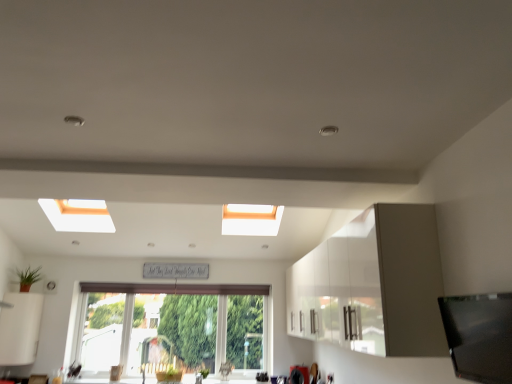
Question: From a real-world perspective, does green leafy plant at lower center, which is counted as the 1th plant, starting from the right, stand above white glossy cabinet at upper right, which is the 1th cabinetry in right-to-left order?

Choices:
 (A) yes
 (B) no

Answer: (B)

Question: Would you consider green leafy plant at lower center, the 2th plant when ordered from top to bottom, to be distant from white glossy cabinet at upper right, which appears as the 2th cabinetry when viewed from the left?

Choices:
 (A) yes
 (B) no

Answer: (A)

Question: From the image's perspective, is green leafy plant at lower center, the 2th plant when ordered from top to bottom, located beneath white glossy cabinet at upper right, which appears as the 2th cabinetry when viewed from the left?

Choices:
 (A) no
 (B) yes

Answer: (B)

Question: Is green leafy plant at lower center, which is counted as the 1th plant, starting from the right, facing away from white glossy cabinet at upper right, which is the 1th cabinetry in right-to-left order?

Choices:
 (A) yes
 (B) no

Answer: (B)

Question: Is green leafy plant at lower center, which ranks as the 2th plant in left-to-right order, next to white glossy cabinet at upper right, which appears as the 2th cabinetry when viewed from the left, and touching it?

Choices:
 (A) no
 (B) yes

Answer: (A)

Question: From a real-world perspective, does green leafy plant at lower center, the 2th plant when ordered from top to bottom, sit lower than white glossy cabinet at upper right, which appears as the 2th cabinetry when viewed from the left?

Choices:
 (A) no
 (B) yes

Answer: (B)

Question: Can you confirm if green matte plant at lower left, the 1th plant in the left-to-right sequence, is smaller than white matte cabinet at lower left, which is counted as the second cabinetry, starting from the right?

Choices:
 (A) no
 (B) yes

Answer: (B)

Question: From the image's perspective, is green matte plant at lower left, the 1th plant in the left-to-right sequence, located beneath white matte cabinet at lower left, which is counted as the second cabinetry, starting from the right?

Choices:
 (A) yes
 (B) no

Answer: (B)

Question: Is green matte plant at lower left, the 1th plant in the left-to-right sequence, positioned before white matte cabinet at lower left, which is counted as the second cabinetry, starting from the right?

Choices:
 (A) no
 (B) yes

Answer: (A)

Question: Does green matte plant at lower left, which is counted as the first plant, starting from the top, appear on the left side of white matte cabinet at lower left, which is counted as the second cabinetry, starting from the right?

Choices:
 (A) no
 (B) yes

Answer: (A)

Question: Is green matte plant at lower left, the 2th plant from the right, positioned behind white matte cabinet at lower left, the 1th cabinetry viewed from the left?

Choices:
 (A) no
 (B) yes

Answer: (B)

Question: Considering the relative positions of green matte plant at lower left, the 2th plant from the right, and white matte cabinet at lower left, which is counted as the second cabinetry, starting from the right, in the image provided, is green matte plant at lower left, the 2th plant from the right, to the right of white matte cabinet at lower left, which is counted as the second cabinetry, starting from the right, from the viewer's perspective?

Choices:
 (A) yes
 (B) no

Answer: (A)

Question: Can you confirm if clear glass window at center is smaller than white matte cabinet at lower left, which is counted as the second cabinetry, starting from the right?

Choices:
 (A) no
 (B) yes

Answer: (A)